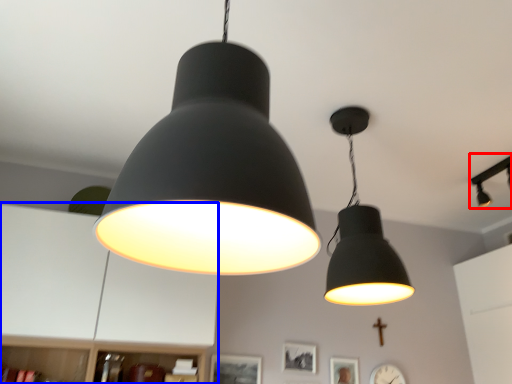
Question: Which object is closer to the camera taking this photo, lamp (highlighted by a red box) or dresser (highlighted by a blue box)?

Choices:
 (A) lamp
 (B) dresser

Answer: (B)